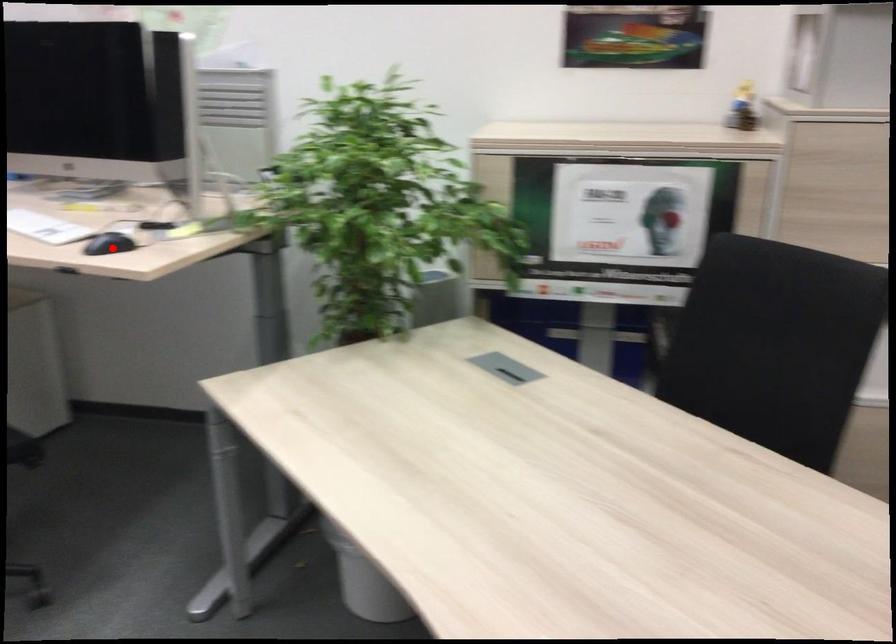
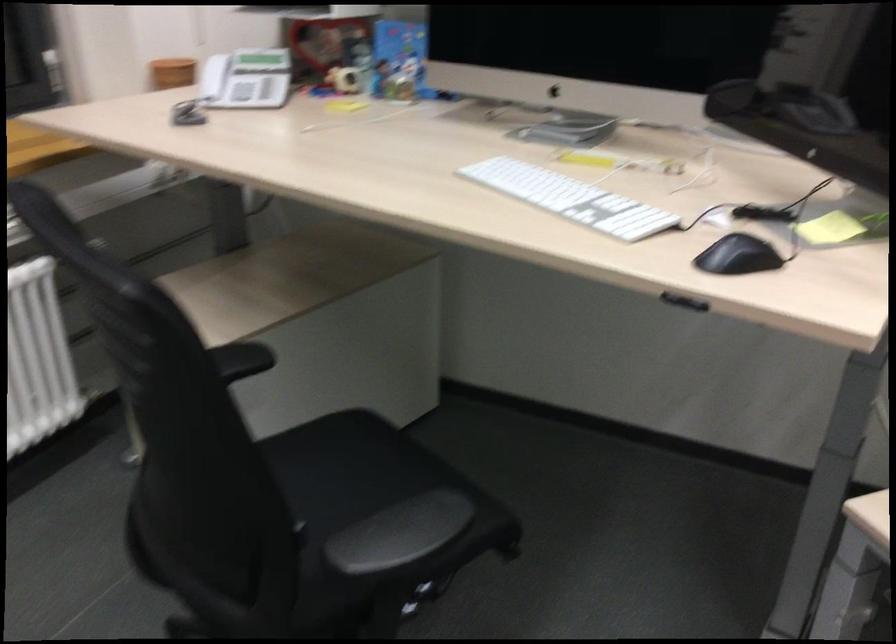
Question: A red point is marked in image1. In image2, is the corresponding 3D point closer to the camera or farther? Reply with the corresponding letter.

Choices:
 (A) The corresponding 3D point is closer.
 (B) The corresponding 3D point is farther.

Answer: (A)